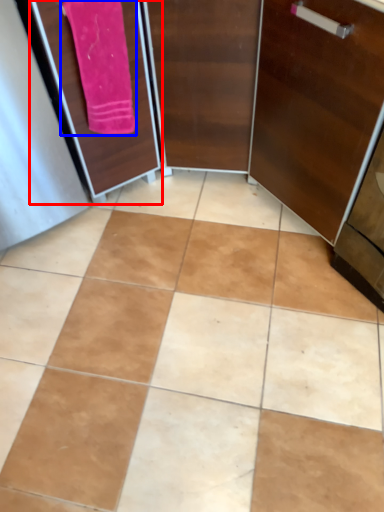
Question: Which object appears farthest to the camera in this image, screen door (highlighted by a red box) or bath towel (highlighted by a blue box)?

Choices:
 (A) screen door
 (B) bath towel

Answer: (B)